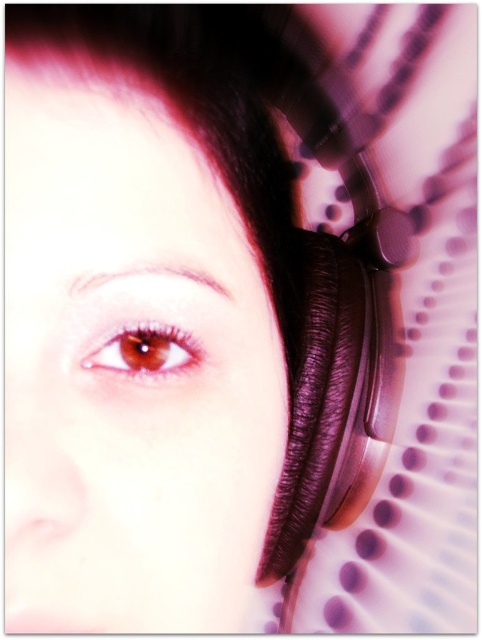
You are a photographer adjusting the lighting for a portrait. You notice the satin brown earphone at right and the brown matte eye at center in the frame. Which object would require more space in the composition to avoid being cut off?

The satin brown earphone at right requires more space in the composition because its width is larger than the brown matte eye at center.

You are taking a photo with your phone and want to focus on the point at coordinates point (361, 346) and point (156, 324). Which point is closer to your camera lens?

Point (156, 324) is closer to the camera lens because the description states that point (361, 346) is further to the camera than point (156, 324).